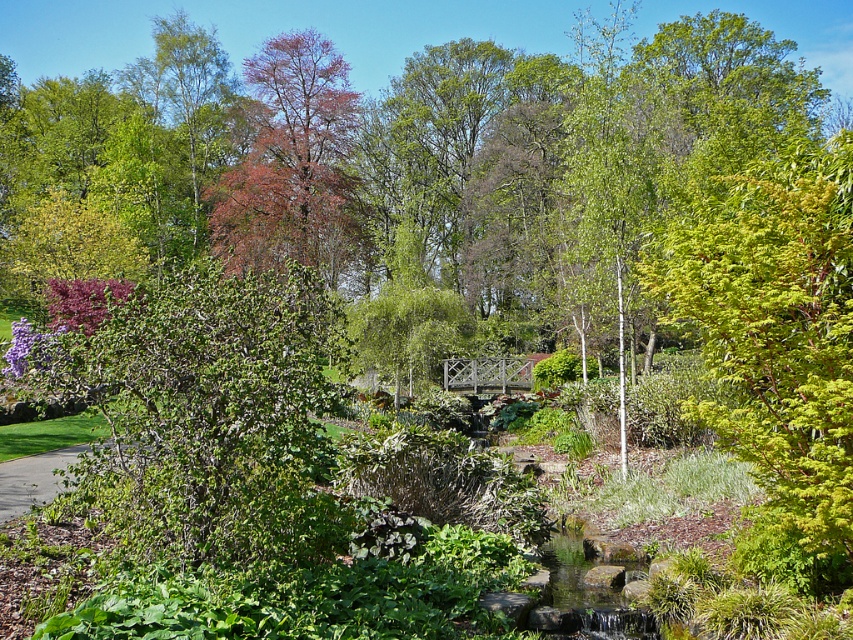
Looking at this image, you are standing in the garden and want to walk from the wooden bridge to the stream. Which point, point (135, 401) or point (13, 484), is closer to you as you start walking towards the stream?

Point (135, 401) is closer to the camera than point (13, 484), so you would reach point (135, 401) first as you walk towards the stream.

You are a gardener planning to trim the green leafy bush at center and the green grass at lower left. Considering their heights, which one will require a ladder to reach the top?

The green leafy bush at center is much taller than the green grass at lower left, so the gardener will need a ladder to trim the green leafy bush at center.

In the scene shown: You are a gardener standing at the edge of the garden, looking towards the wooden bridge. You notice the green leafy bush at center and the green grass at lower left. Which object is nearer to you?

The green leafy bush at center is closer to the viewer than the green grass at lower left.